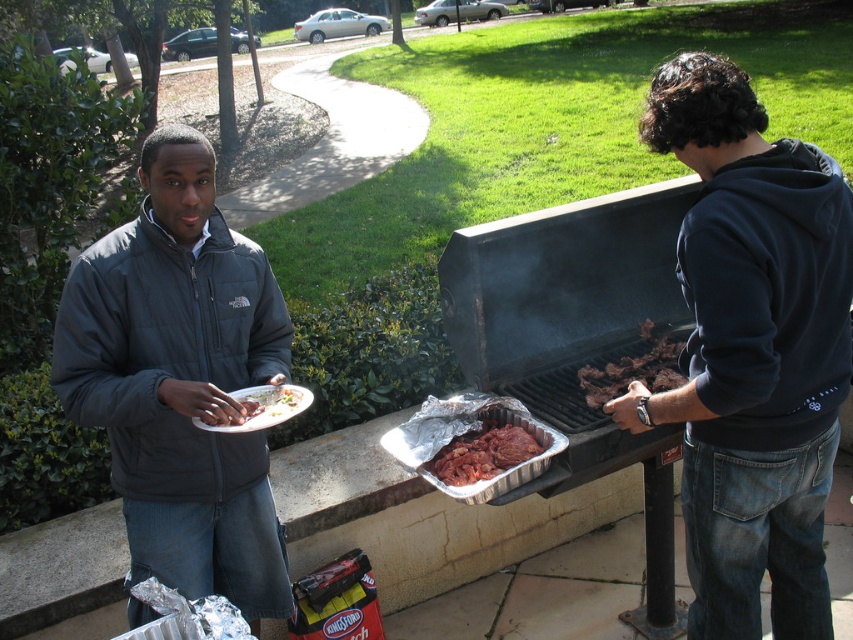
Question: Which point is closer to the camera?

Choices:
 (A) raw red meat at center
 (B) dark blue hoodie at right
 (C) dark gray fleece jacket at left
 (D) brown charred meat at grill right

Answer: (B)

Question: Among these points, which one is nearest to the camera?

Choices:
 (A) (779, 198)
 (B) (251, 424)

Answer: (A)

Question: Based on their relative distances, which object is farther from the raw red meat at center?

Choices:
 (A) dark blue fleece sweatshirt at right
 (B) brown charred meat at grill right
 (C) white matte plate at center

Answer: (A)

Question: Where is dark blue hoodie at right located in relation to brown charred meat at grill right in the image?

Choices:
 (A) right
 (B) left

Answer: (A)

Question: Does raw red meat at center come in front of brown charred meat at grill right?

Choices:
 (A) no
 (B) yes

Answer: (B)

Question: Is raw red meat at center thinner than white matte plate at center?

Choices:
 (A) no
 (B) yes

Answer: (A)